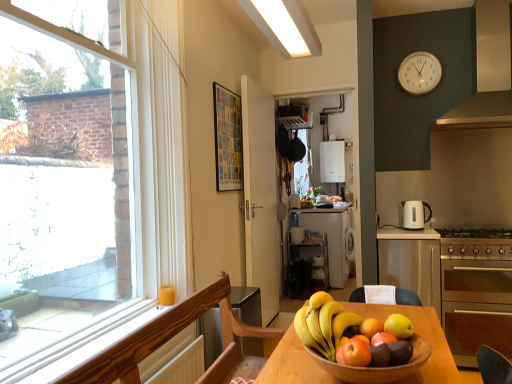
I want to click on free location above white plastic clock at upper right (from a real-world perspective), so click(420, 46).